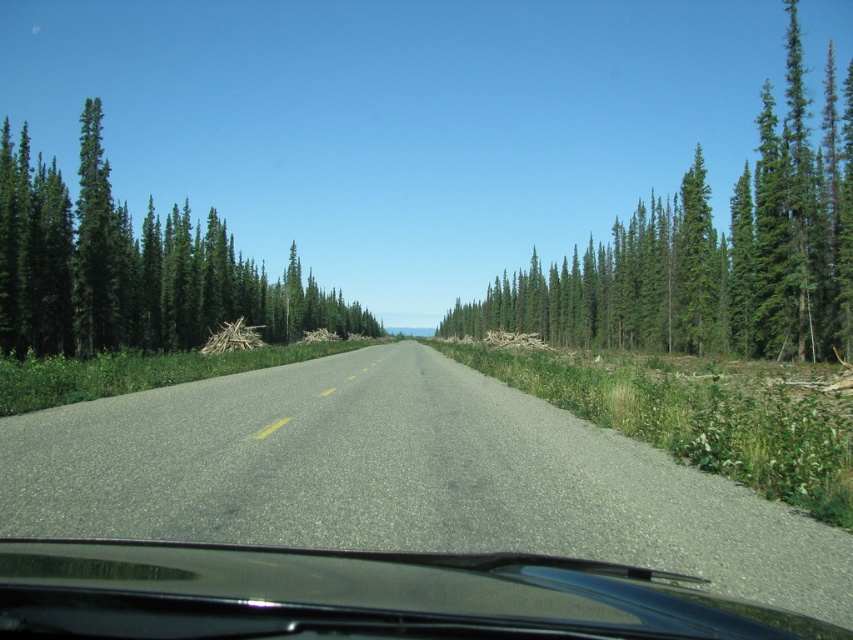
You are a hiker standing on the road between the green coniferous trees at right and the green coniferous trees at left. You want to walk to the nearest tree on either side. Which direction should you go?

The green coniferous trees at right and green coniferous trees at left are 68.71 meters apart. Since you are standing exactly between them, both are equally distant. You can choose either direction to reach a tree at the same distance.

You are a driver looking through the windshield of your car. You see the asphalt road at center and the black glossy windshield wiper at center. Which object is closer to you?

The black glossy windshield wiper at center is closer to you since it is above the asphalt road at center.

You are a hiker standing on the road and looking towards the horizon. You notice green coniferous trees at right and green coniferous trees at left. Which group of trees appears closer to you?

The green coniferous trees at right are located above the green coniferous trees at left, which indicates they are closer to you due to the way perspective works in visual scenes.